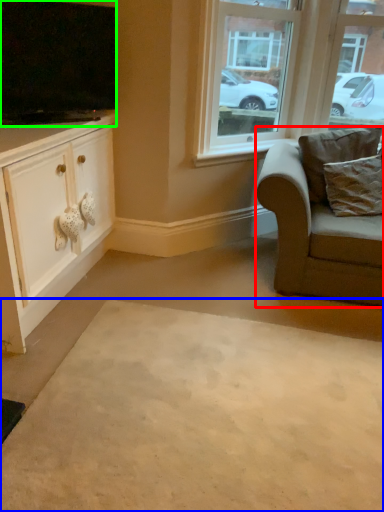
Question: Which is nearer to the chair (highlighted by a red box)? plain (highlighted by a blue box) or television (highlighted by a green box).

Choices:
 (A) plain
 (B) television

Answer: (A)